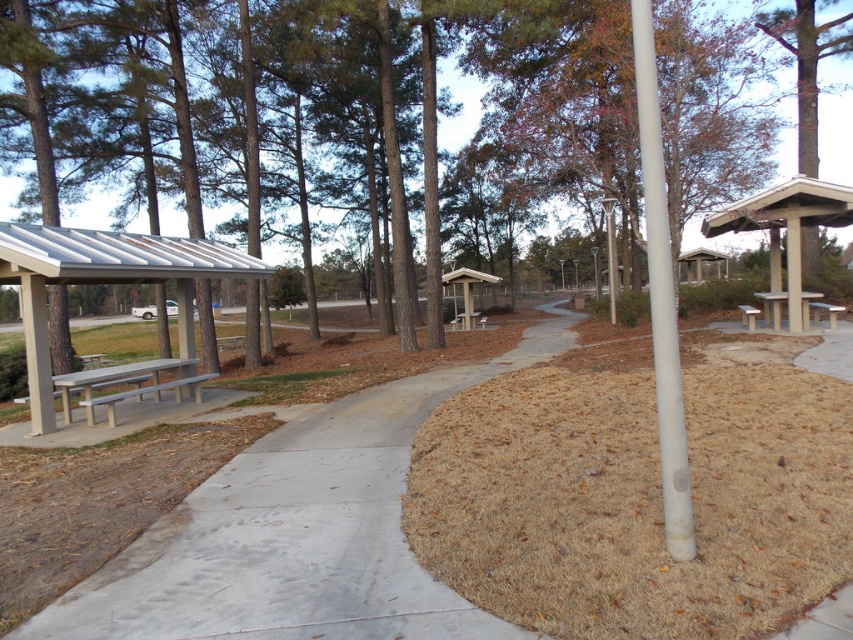
Question: Can you confirm if white smooth pole at center is positioned above wooden bench at upper right?

Choices:
 (A) no
 (B) yes

Answer: (A)

Question: Which point is closer to the camera?

Choices:
 (A) light gray concrete bench at left
 (B) beige concrete bus stop at upper right
 (C) matte gray picnic table at right
 (D) wooden bench at upper right

Answer: (A)

Question: Which object is closer to the camera taking this photo?

Choices:
 (A) matte gray picnic table at right
 (B) wooden bus stop at center
 (C) wooden bench at center
 (D) wooden bench at upper right

Answer: (D)

Question: Does wooden bench at upper right have a smaller size compared to wooden bus stop at center?

Choices:
 (A) no
 (B) yes

Answer: (B)

Question: Which point is closer to the camera taking this photo?

Choices:
 (A) (112, 268)
 (B) (817, 314)
 (C) (686, 500)
 (D) (233, 342)

Answer: (C)

Question: In this image, where is gray concrete bench at left located relative to wooden park bench at center?

Choices:
 (A) right
 (B) left

Answer: (B)